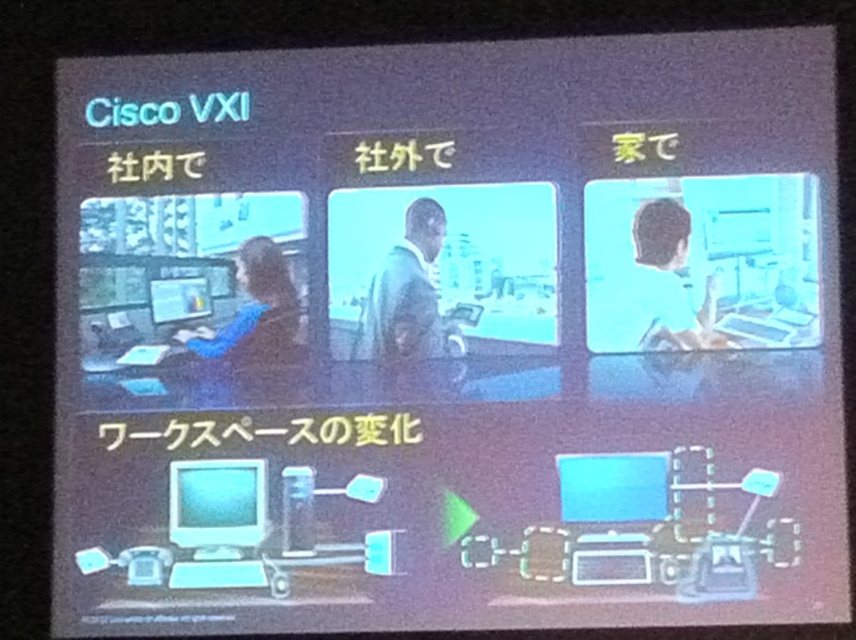
You are a remote worker who needs to identify your equipment in a presentation slide. You see a white glossy computer monitor at lower left and a blue matte shirt at center. Which object is positioned to the left of the other?

The white glossy computer monitor at lower left is positioned to the left of the blue matte shirt at center.

You are an office manager assessing workspace layouts. In the slide depicting the office environment labeled quotSahai de quot, you notice a matte black person at center and a green matte jacket at center. Which object occupies more horizontal space in this section?

The matte black person at center might be wider than the green matte jacket at center, so the matte black person at center likely takes up more horizontal space in this section.